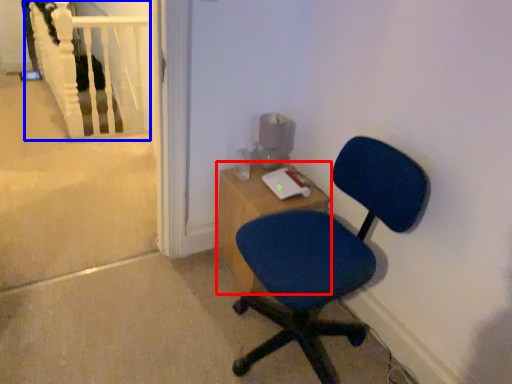
Question: Which object appears farthest to the camera in this image, desk (highlighted by a red box) or rail (highlighted by a blue box)?

Choices:
 (A) desk
 (B) rail

Answer: (B)